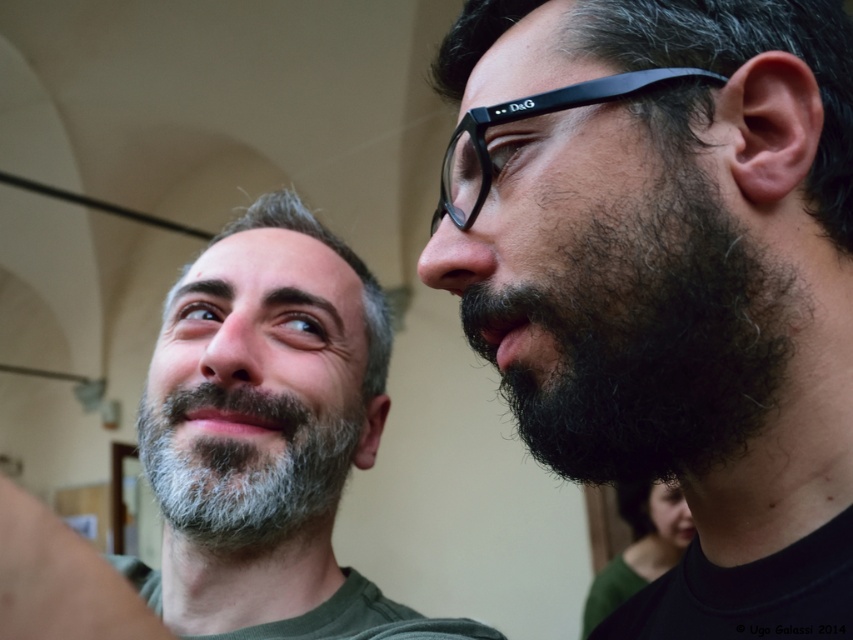
Does dark brown curly beard at right come in front of graywoollybeard at left?

That is True.

Can you confirm if dark brown curly beard at right is wider than graywoollybeard at left?

No, dark brown curly beard at right is not wider than graywoollybeard at left.

Who is more distant from viewer, (515, 364) or (219, 502)?

The point (219, 502) is behind.

This screenshot has width=853, height=640. Identify the location of dark brown curly beard at right. (646, 340).

Who is positioned more to the left, graywoollybeard at left or black plastic glasses at upper right?

graywoollybeard at left

Is point (202, 404) positioned before point (473, 202)?

No.

This screenshot has width=853, height=640. What are the coordinates of `graywoollybeard at left` in the screenshot? It's located at (245, 467).

At what (x,y) coordinates should I click in order to perform the action: click on graywoollybeard at left. Please return your answer as a coordinate pair (x, y). The image size is (853, 640). Looking at the image, I should click on (245, 467).

Between dark brown hair at right and dark brown curly beard at right, which one appears on the right side from the viewer's perspective?

From the viewer's perspective, dark brown hair at right appears more on the right side.

Is dark brown hair at right smaller than dark brown curly beard at right?

No, dark brown hair at right is not smaller than dark brown curly beard at right.

Is point (792, 516) closer to camera compared to point (566, 276)?

No, (792, 516) is further to viewer.

Locate an element on the screen. The height and width of the screenshot is (640, 853). dark brown hair at right is located at coordinates (676, 284).